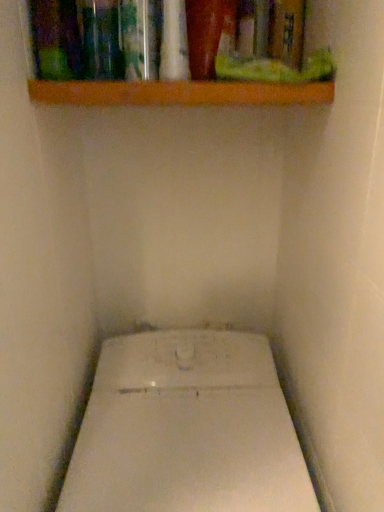
Question: From the image's perspective, is wooden shelf at upper center above or below white glossy toilet at center?

Choices:
 (A) above
 (B) below

Answer: (A)

Question: Is wooden shelf at upper center bigger or smaller than white glossy toilet at center?

Choices:
 (A) small
 (B) big

Answer: (A)

Question: Is wooden shelf at upper center in front of or behind white glossy toilet at center in the image?

Choices:
 (A) behind
 (B) front

Answer: (A)

Question: Is white glossy toilet at center bigger or smaller than wooden shelf at upper center?

Choices:
 (A) big
 (B) small

Answer: (A)

Question: Looking at their shapes, would you say white glossy toilet at center is wider or thinner than wooden shelf at upper center?

Choices:
 (A) wide
 (B) thin

Answer: (A)

Question: Visually, is white glossy toilet at center positioned to the left or to the right of wooden shelf at upper center?

Choices:
 (A) left
 (B) right

Answer: (B)

Question: From a real-world perspective, is white glossy toilet at center positioned above or below wooden shelf at upper center?

Choices:
 (A) above
 (B) below

Answer: (B)